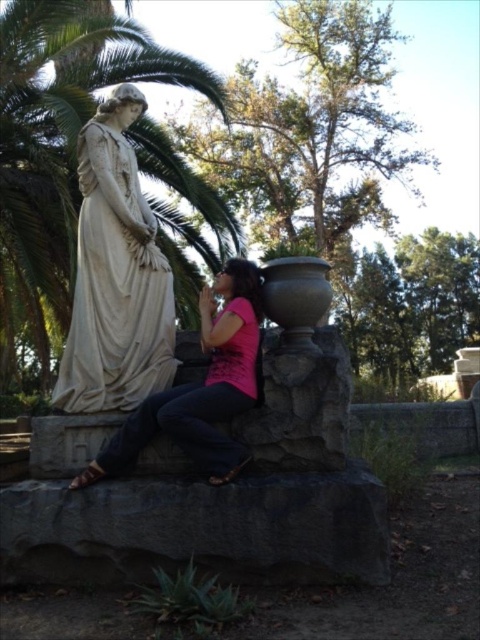
Question: Is white marble statue at left above matte white statue at left?

Choices:
 (A) no
 (B) yes

Answer: (B)

Question: Which object is positioned closest to the matte white statue at left?

Choices:
 (A) white marble statue at left
 (B) green leafy palm tree at upper left

Answer: (A)

Question: In this image, where is white marble statue at left located relative to matte white statue at left?

Choices:
 (A) above
 (B) below

Answer: (A)

Question: Is white marble statue at left to the right of matte white statue at left from the viewer's perspective?

Choices:
 (A) yes
 (B) no

Answer: (B)

Question: Which object is the farthest from the white marble statue at left?

Choices:
 (A) matte white statue at left
 (B) green leafy palm tree at upper left

Answer: (B)

Question: Which object appears farthest from the camera in this image?

Choices:
 (A) matte white statue at left
 (B) white marble statue at left

Answer: (B)